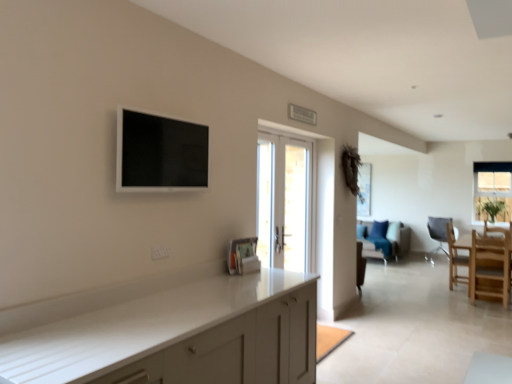
Question: Considering the relative positions of matte black flat screen tv at upper left and white glossy door at center in the image provided, is matte black flat screen tv at upper left to the left of white glossy door at center from the viewer's perspective?

Choices:
 (A) no
 (B) yes

Answer: (B)

Question: Is the surface of matte black flat screen tv at upper left in direct contact with white glossy door at center?

Choices:
 (A) yes
 (B) no

Answer: (B)

Question: Can you confirm if matte black flat screen tv at upper left is wider than white glossy door at center?

Choices:
 (A) no
 (B) yes

Answer: (B)

Question: Considering the relative positions of matte black flat screen tv at upper left and white glossy door at center in the image provided, is matte black flat screen tv at upper left to the right of white glossy door at center from the viewer's perspective?

Choices:
 (A) no
 (B) yes

Answer: (A)

Question: Can you confirm if matte black flat screen tv at upper left is smaller than white glossy door at center?

Choices:
 (A) no
 (B) yes

Answer: (B)

Question: From a real-world perspective, is matte black flat screen tv at upper left located beneath white glossy door at center?

Choices:
 (A) no
 (B) yes

Answer: (A)

Question: From a real-world perspective, is velvet blue couch at center on top of matte black flat screen tv at upper left?

Choices:
 (A) yes
 (B) no

Answer: (B)

Question: Considering the relative sizes of velvet blue couch at center and matte black flat screen tv at upper left in the image provided, is velvet blue couch at center shorter than matte black flat screen tv at upper left?

Choices:
 (A) yes
 (B) no

Answer: (B)

Question: Can you confirm if velvet blue couch at center is taller than matte black flat screen tv at upper left?

Choices:
 (A) no
 (B) yes

Answer: (B)

Question: From the image's perspective, is velvet blue couch at center on top of matte black flat screen tv at upper left?

Choices:
 (A) no
 (B) yes

Answer: (A)

Question: From the image's perspective, would you say velvet blue couch at center is shown under matte black flat screen tv at upper left?

Choices:
 (A) yes
 (B) no

Answer: (A)

Question: From a real-world perspective, is velvet blue couch at center positioned under matte black flat screen tv at upper left based on gravity?

Choices:
 (A) no
 (B) yes

Answer: (B)

Question: Are wooden chair at right, placed as the 2th chair when sorted from front to back, and matte gray chair at right, which is the 1th chair from back to front, far apart?

Choices:
 (A) yes
 (B) no

Answer: (A)